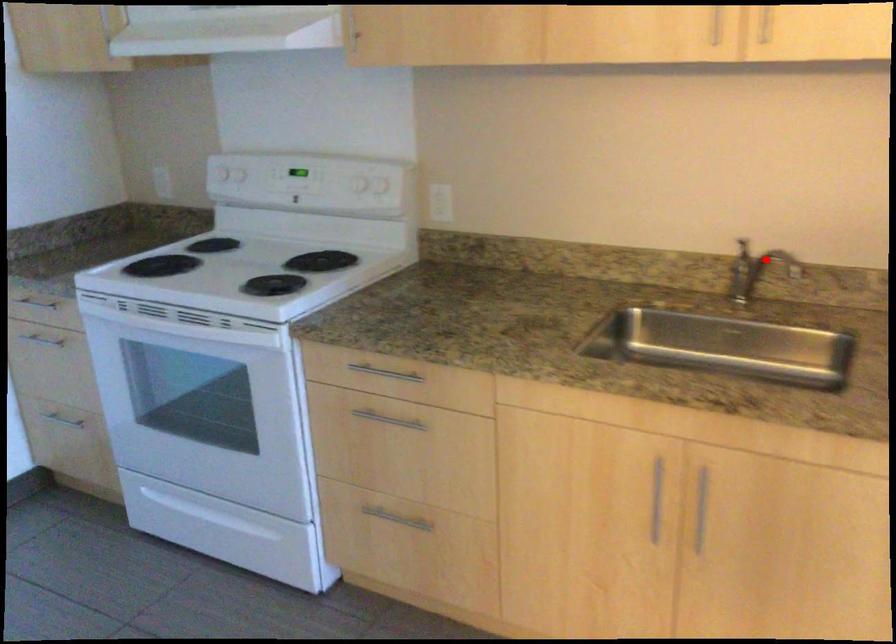
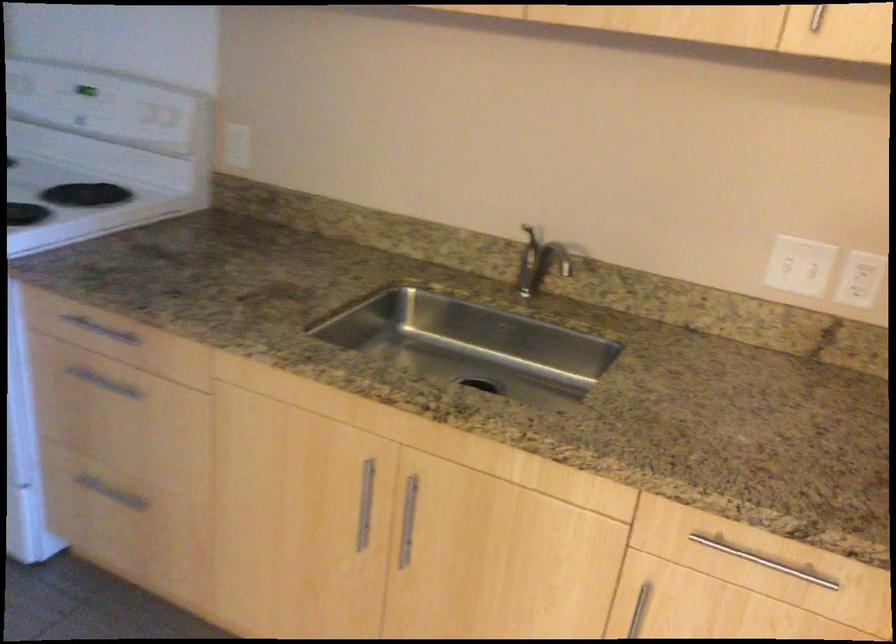
The point at the highlighted location is marked in the first image. Where is the corresponding point in the second image?

(545, 251)